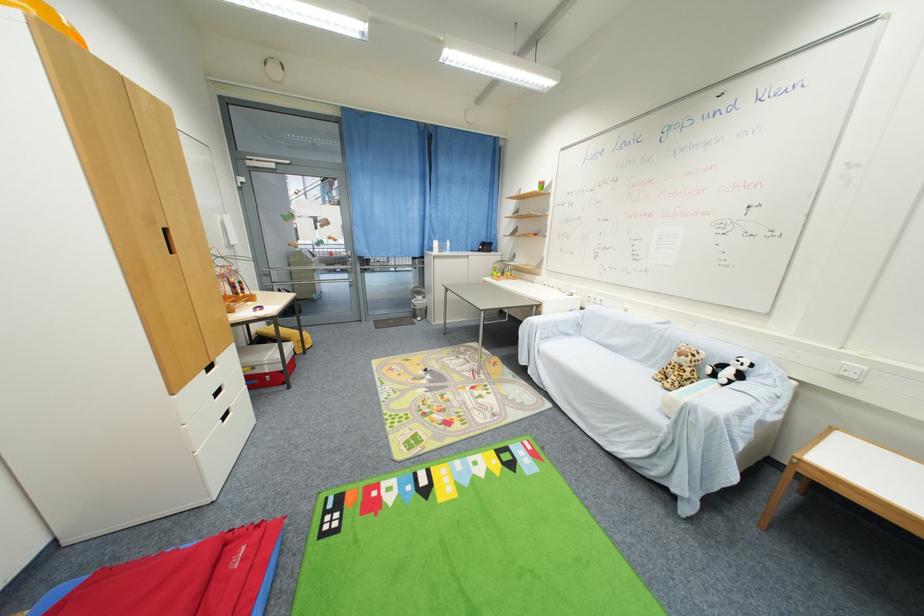
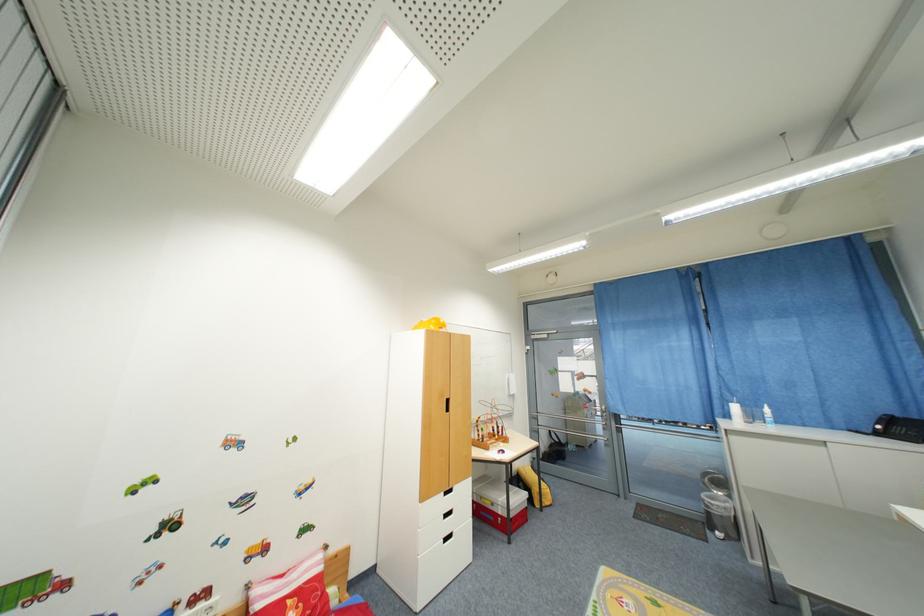
In the second image, find the point that corresponds to (441,245) in the first image.

(740, 410)